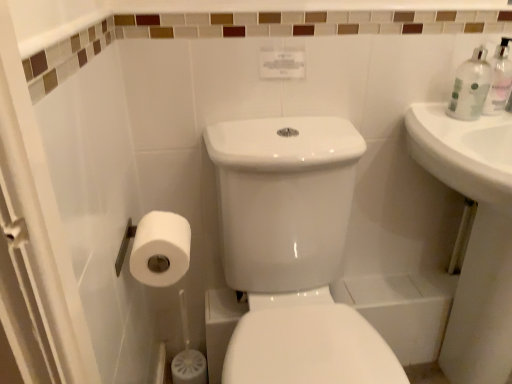
Question: Does clear plastic bottle at upper right have a lesser height compared to white glossy sink at right?

Choices:
 (A) no
 (B) yes

Answer: (B)

Question: Does clear plastic bottle at upper right have a larger size compared to white glossy sink at right?

Choices:
 (A) no
 (B) yes

Answer: (A)

Question: From the image's perspective, is clear plastic bottle at upper right located above white glossy sink at right?

Choices:
 (A) yes
 (B) no

Answer: (A)

Question: Can you confirm if clear plastic bottle at upper right is positioned to the right of white glossy sink at right?

Choices:
 (A) yes
 (B) no

Answer: (A)

Question: From the image's perspective, does clear plastic bottle at upper right appear lower than white glossy sink at right?

Choices:
 (A) yes
 (B) no

Answer: (B)

Question: Is clear plastic bottle at upper right not close to white glossy sink at right?

Choices:
 (A) yes
 (B) no

Answer: (B)

Question: Are white glossy porcelain at center and clear plastic bottle at upper right located far from each other?

Choices:
 (A) yes
 (B) no

Answer: (B)

Question: Could you tell me if white glossy porcelain at center is turned towards clear plastic bottle at upper right?

Choices:
 (A) yes
 (B) no

Answer: (B)

Question: From a real-world perspective, is white glossy porcelain at center over clear plastic bottle at upper right?

Choices:
 (A) no
 (B) yes

Answer: (A)

Question: Can you confirm if white glossy porcelain at center is wider than clear plastic bottle at upper right?

Choices:
 (A) yes
 (B) no

Answer: (A)

Question: Is white glossy porcelain at center shorter than clear plastic bottle at upper right?

Choices:
 (A) yes
 (B) no

Answer: (B)

Question: Is white glossy porcelain at center at the right side of clear plastic bottle at upper right?

Choices:
 (A) no
 (B) yes

Answer: (A)

Question: Considering the relative sizes of white matte toilet paper at lower left and clear plastic bottle at upper right in the image provided, is white matte toilet paper at lower left taller than clear plastic bottle at upper right?

Choices:
 (A) no
 (B) yes

Answer: (A)